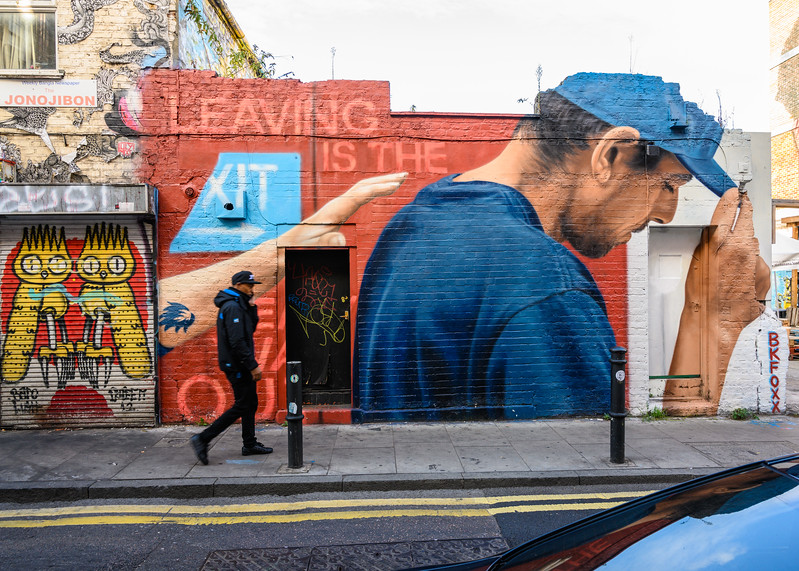
Where is `wall`? wall is located at coordinates (388, 138).